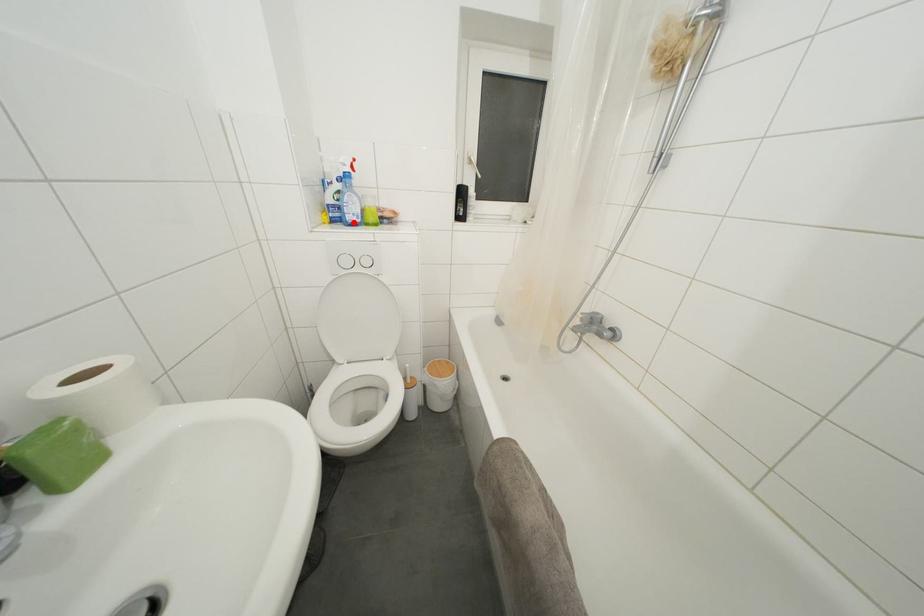
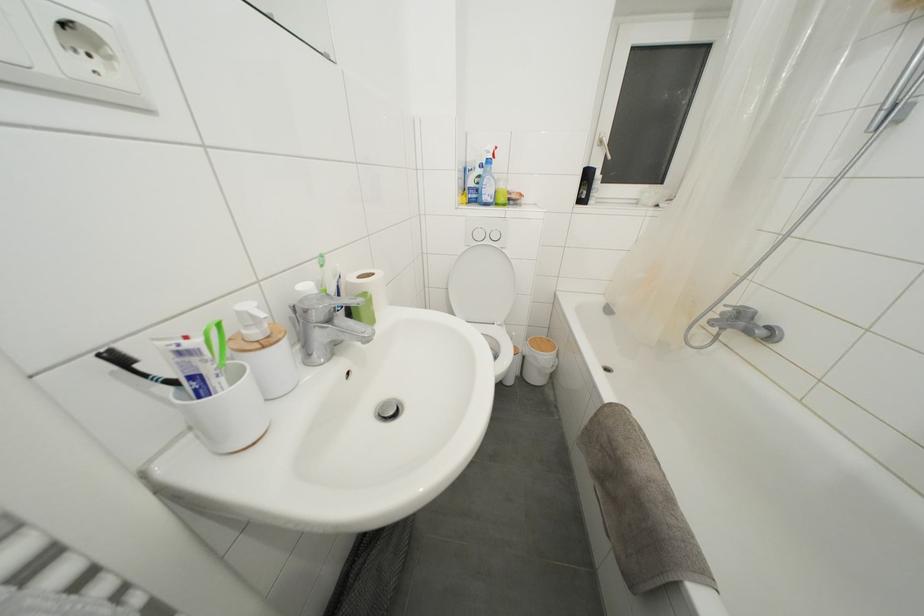
Where in the second image is the point corresponding to the highlighted location from the first image?

(490, 203)